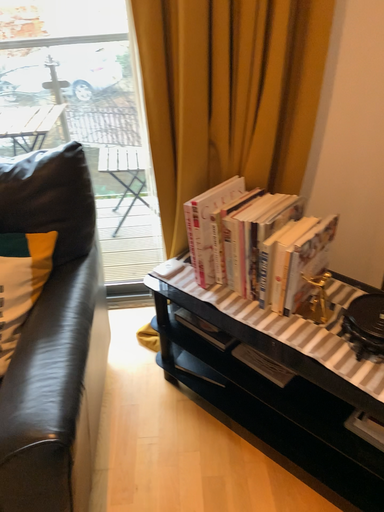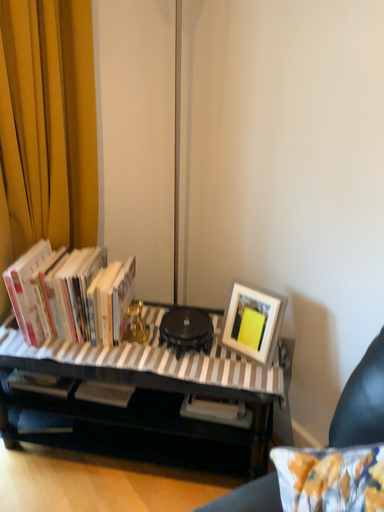
Question: Which way did the camera rotate in the video?

Choices:
 (A) rotated right
 (B) rotated left

Answer: (A)